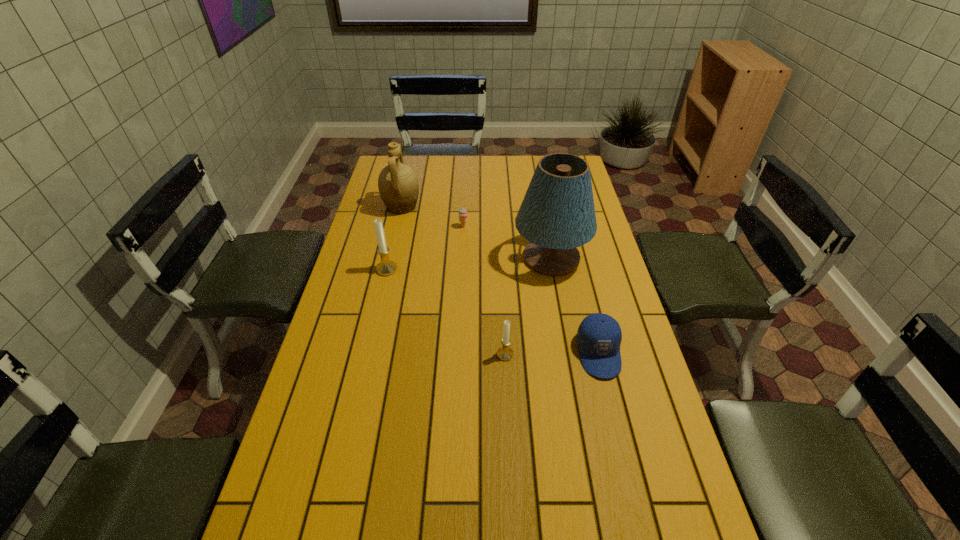
This screenshot has width=960, height=540. What are the coordinates of `free space located 0.100m on the back of the taller candle holder` in the screenshot? It's located at (393, 244).

The width and height of the screenshot is (960, 540). Find the location of `vacant space situated on the left of the shorter candle holder`. vacant space situated on the left of the shorter candle holder is located at coordinates (411, 354).

Locate an element on the screen. This screenshot has height=540, width=960. vacant region located 0.320m on the back of the pitcher is located at coordinates (413, 158).

Locate an element on the screen. free spot located on the left of the third object from left to right is located at coordinates (422, 226).

I want to click on vacant space located on the back of the tallest object, so click(543, 218).

At what (x,y) coordinates should I click in order to perform the action: click on free space located on the front-facing side of the cap. Please return your answer as a coordinate pair (x, y). Looking at the image, I should click on (637, 514).

Where is `candle holder that is at the left edge`? The image size is (960, 540). candle holder that is at the left edge is located at coordinates (386, 267).

Image resolution: width=960 pixels, height=540 pixels. I want to click on pitcher that is positioned at the left edge, so click(398, 185).

Identify the location of lampshade at the right edge. (557, 214).

The width and height of the screenshot is (960, 540). Find the location of `cap that is at the right edge`. cap that is at the right edge is located at coordinates (599, 336).